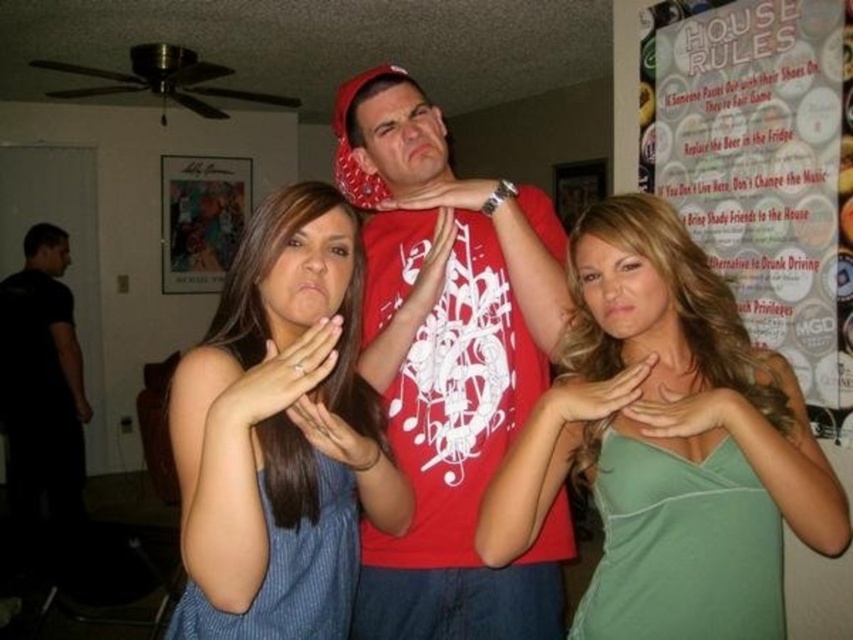
You are standing in the room where the photo was taken and want to place a small decoration between the two points marked as point (688, 572) and point (473, 214). Which point should the decoration be closer to in order to be positioned between them?

The decoration should be closer to point (473, 214) because point (688, 572) is in front of point (473, 214), meaning it is closer to the viewer. Placing the decoration between them would require it to be closer to the farther point to maintain the spatial relationship.